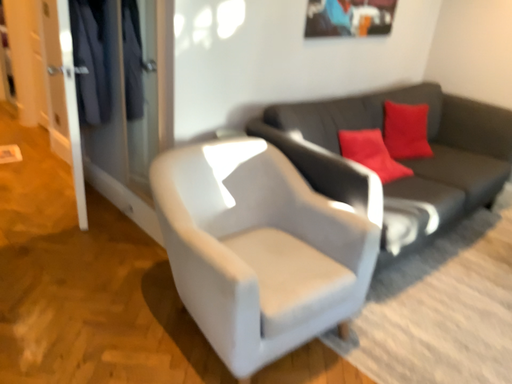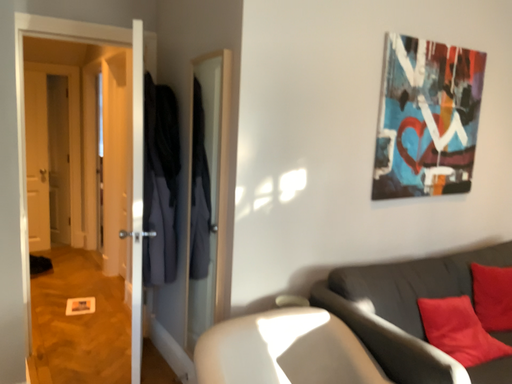
Question: Which way did the camera rotate in the video?

Choices:
 (A) rotated right
 (B) rotated left

Answer: (B)